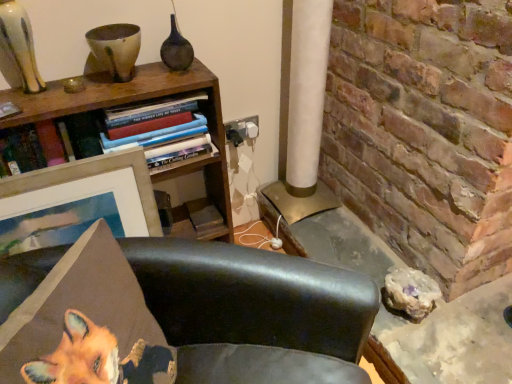
Question: Considering the positions of point (159, 155) and point (219, 99), is point (159, 155) closer or farther from the camera than point (219, 99)?

Choices:
 (A) farther
 (B) closer

Answer: (B)

Question: Looking at their shapes, would you say hardcover books at upper left is wider or thinner than woodenmaterial/texturebookcase at upper left?

Choices:
 (A) wide
 (B) thin

Answer: (A)

Question: Based on their relative distances, which object is nearer to the woodenmaterial/texturebookcase at upper left?

Choices:
 (A) metallic gold table at lower right
 (B) white paper lampshade at center
 (C) matte dark brown vase at upper center
 (D) wooden picture frame at upper left
 (E) leather chair at lower center

Answer: (D)

Question: Which object is positioned closest to the white paper lampshade at center?

Choices:
 (A) matte dark brown vase at upper center
 (B) wooden picture frame at upper left
 (C) metallic gold table at lower right
 (D) hardcover books at upper left
 (E) woodenmaterial/texturebookcase at upper left

Answer: (E)